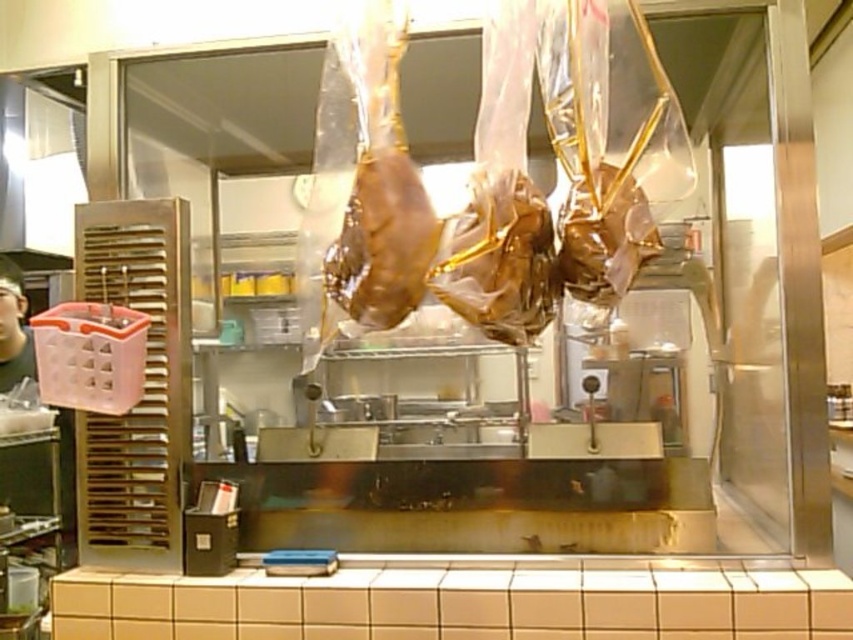
The image size is (853, 640). What do you see at coordinates (500, 259) in the screenshot? I see `shiny gold meat at center` at bounding box center [500, 259].

Between shiny gold meat at center and gold foil wrapped meat at center, which one has less height?

gold foil wrapped meat at center

In order to click on shiny gold meat at center in this screenshot , I will do `click(500, 259)`.

Between shiny gold meat at center and brown glossy meat at center, which one has less height?

shiny gold meat at center is shorter.

Can you confirm if shiny gold meat at center is smaller than brown glossy meat at center?

Actually, shiny gold meat at center might be larger than brown glossy meat at center.

Locate an element on the screen. The height and width of the screenshot is (640, 853). shiny gold meat at center is located at coordinates (500, 259).

Where is `shiny gold meat at center`? shiny gold meat at center is located at coordinates (500, 259).

Describe the element at coordinates (381, 241) in the screenshot. The height and width of the screenshot is (640, 853). I see `brown glossy meat at center` at that location.

Which is above, brown glossy meat at center or gold foil wrapped meat at center?

brown glossy meat at center

Is point (364, 237) farther from viewer compared to point (564, 253)?

No.

This screenshot has width=853, height=640. What are the coordinates of `brown glossy meat at center` in the screenshot? It's located at (381, 241).